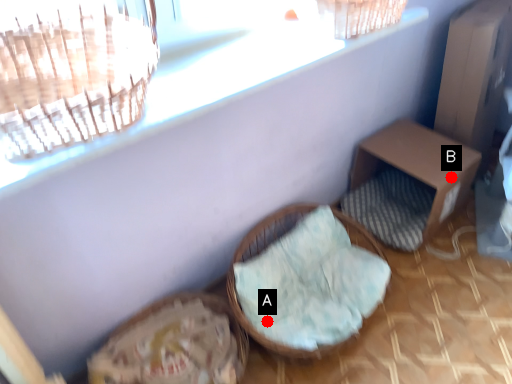
Question: Two points are circled on the image, labeled by A and B beside each circle. Which of the following is the closest to the observer?

Choices:
 (A) A is closer
 (B) B is closer

Answer: (A)